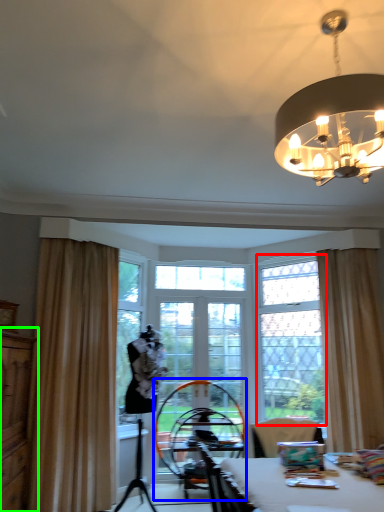
Question: Which object is positioned closest to window frame (highlighted by a red box)? Select from swivel chair (highlighted by a blue box) and dresser (highlighted by a green box).

Choices:
 (A) swivel chair
 (B) dresser

Answer: (A)